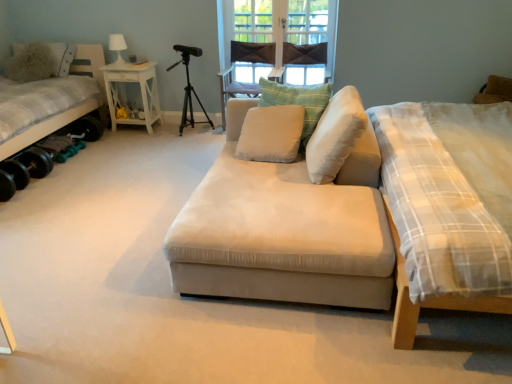
Question: From a real-world perspective, is white soft cushion at center, which is the fourth pillow from left to right, above or below light beige fabric armchair at center?

Choices:
 (A) above
 (B) below

Answer: (A)

Question: Is white soft cushion at center, which is the fourth pillow from left to right, to the left or to the right of light beige fabric armchair at center in the image?

Choices:
 (A) right
 (B) left

Answer: (A)

Question: Which of these objects is positioned farthest from the white soft cushion at center, which is the 1th pillow in right-to-left order?

Choices:
 (A) fuzzy fabric pillow at upper left, marked as the 1th pillow in a left-to-right arrangement
 (B) white fabric bed at left
 (C) white soft cushion at center, acting as the second pillow starting from the back
 (D) beige fabric couch at center
 (E) white soft cushion at center, marked as the third pillow in a right-to-left arrangement

Answer: (A)

Question: Estimate the real-world distances between objects in this image. Which object is farther from the white matte table lamp at upper left?

Choices:
 (A) beige fabric couch at center
 (B) black matte tripod at center
 (C) white wood side table at left
 (D) light beige fabric armchair at center
 (E) dark fabric window screen at center

Answer: (A)